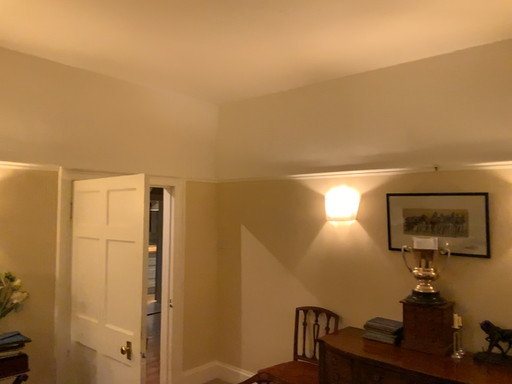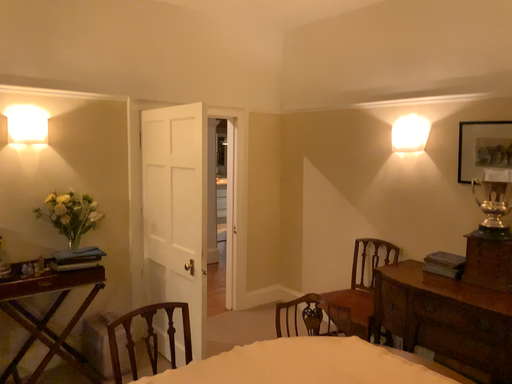
Question: How did the camera likely rotate when shooting the video?

Choices:
 (A) rotated right
 (B) rotated left

Answer: (B)